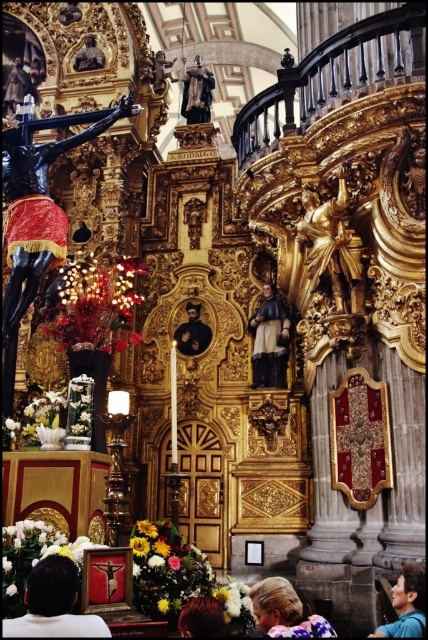
Question: Which point appears farthest from the camera in this image?

Choices:
 (A) 30,588
 (B) 103,58

Answer: (B)

Question: Is dark brown hair at lower center above smooth gold statue at upper center?

Choices:
 (A) yes
 (B) no

Answer: (B)

Question: Among these objects, which one is nearest to the camera?

Choices:
 (A) polished bronze statue at upper center
 (B) smooth blue shirt at lower right
 (C) smooth black portrait at center
 (D) smooth gold statue at upper center

Answer: (B)

Question: Can you confirm if dark brown hair at lower center is wider than smooth black portrait at center?

Choices:
 (A) yes
 (B) no

Answer: (B)

Question: Does matte black statue at center have a smaller size compared to smooth wood statue at upper center?

Choices:
 (A) no
 (B) yes

Answer: (A)

Question: Which point is closer to the camera taking this photo?

Choices:
 (A) (315, 243)
 (B) (418, 586)
 (C) (207, 93)

Answer: (B)